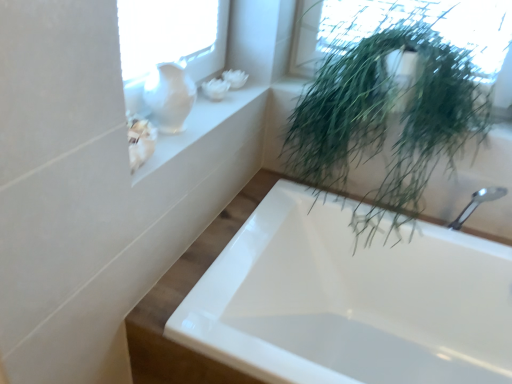
Question: Visually, is green leafy plant at upper right positioned to the left or to the right of white glossy vase at upper left?

Choices:
 (A) right
 (B) left

Answer: (A)

Question: Relative to white glossy vase at upper left, is green leafy plant at upper right in front or behind?

Choices:
 (A) front
 (B) behind

Answer: (B)

Question: Estimate the real-world distances between objects in this image. Which object is farther from the white glossy vase at upper left?

Choices:
 (A) white glossy bathtub at lower right
 (B) green leafy plant at upper right
 (C) white glass vase at upper left

Answer: (A)

Question: Which object is the farthest from the white glass vase at upper left?

Choices:
 (A) white glossy vase at upper left
 (B) green leafy plant at upper right
 (C) white glossy bathtub at lower right

Answer: (C)